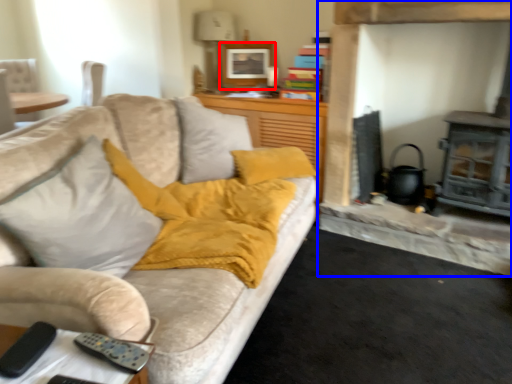
Question: Which object appears closest to the camera in this image, picture frame (highlighted by a red box) or fireplace (highlighted by a blue box)?

Choices:
 (A) picture frame
 (B) fireplace

Answer: (B)